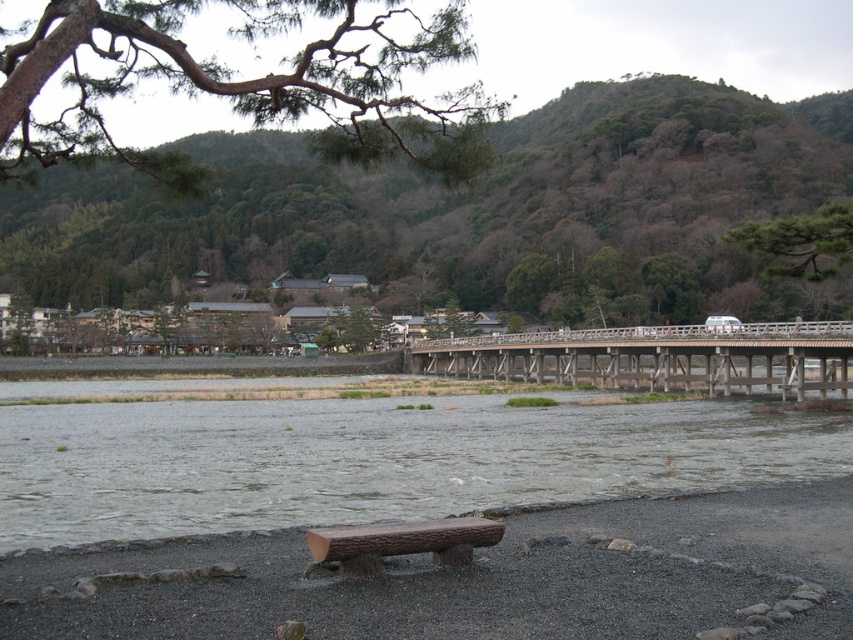
Question: Considering the real-world distances, which object is closest to the brown wood bench at lower center?

Choices:
 (A) green leafy branch at upper left
 (B) gray concrete river at lower center
 (C) green textured pine tree at upper right

Answer: (A)

Question: Observing the image, what is the correct spatial positioning of gray concrete river at lower center in reference to green leafy branch at upper left?

Choices:
 (A) above
 (B) below

Answer: (B)

Question: Observing the image, what is the correct spatial positioning of gray concrete river at lower center in reference to green textured pine tree at upper right?

Choices:
 (A) right
 (B) left

Answer: (B)

Question: Which object is the closest to the brown wood bench at lower center?

Choices:
 (A) green leafy hillside at upper center
 (B) green leafy branch at upper left
 (C) wooden bridge at center
 (D) gray concrete river at lower center

Answer: (B)

Question: Which of the following is the closest to the observer?

Choices:
 (A) brown wood bench at lower center
 (B) green leafy branch at upper left

Answer: (B)

Question: Where is brown wood bench at lower center located in relation to green textured pine tree at upper right in the image?

Choices:
 (A) below
 (B) above

Answer: (A)